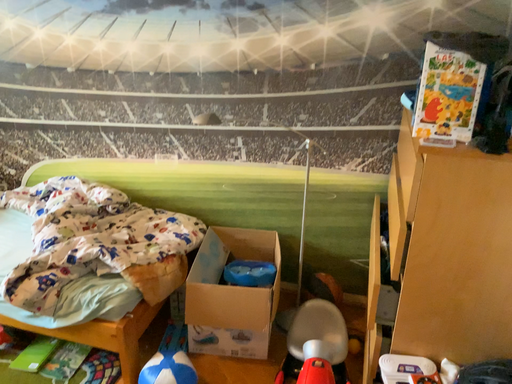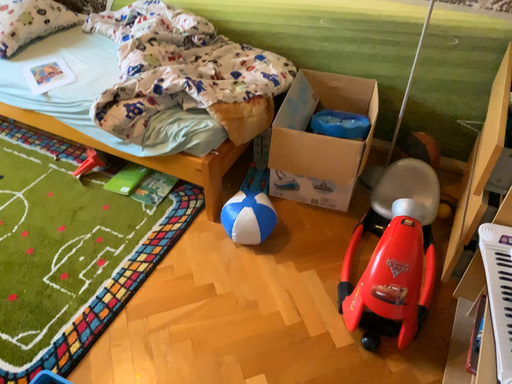
Question: How did the camera likely rotate when shooting the video?

Choices:
 (A) rotated downward
 (B) rotated upward

Answer: (A)